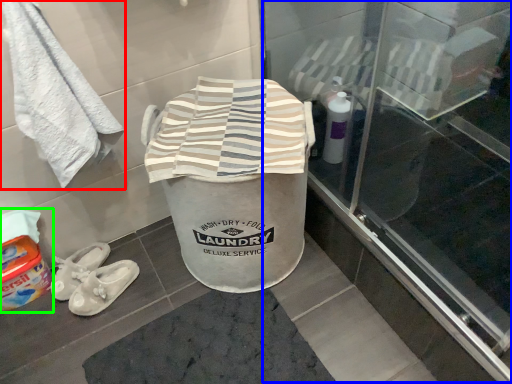
Question: Based on their relative distances, which object is nearer to towel (highlighted by a red box)? Choose from screen door (highlighted by a blue box) and wash (highlighted by a green box).

Choices:
 (A) screen door
 (B) wash

Answer: (B)